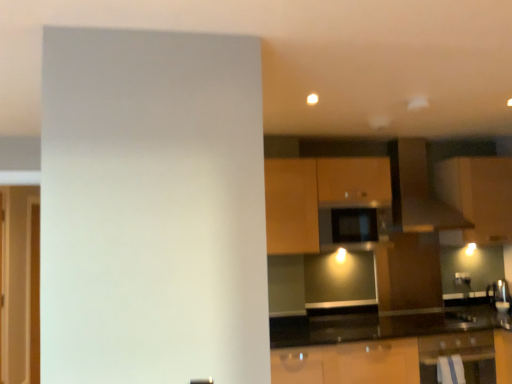
Question: Is matte brown cabinet at upper right, the 3th cabinetry from the left, positioned beyond the bounds of matte brown cabinet at center, marked as the second cabinetry in a left-to-right arrangement?

Choices:
 (A) no
 (B) yes

Answer: (B)

Question: Is matte brown cabinet at upper right, which is the 1th cabinetry in right-to-left order, shorter than matte brown cabinet at center, marked as the second cabinetry in a left-to-right arrangement?

Choices:
 (A) yes
 (B) no

Answer: (B)

Question: Is matte brown cabinet at upper right, the 3th cabinetry from the left, aimed at matte brown cabinet at center, which is counted as the 2th cabinetry, starting from the right?

Choices:
 (A) no
 (B) yes

Answer: (A)

Question: From a real-world perspective, is matte brown cabinet at upper right, the 3th cabinetry from the left, located higher than matte brown cabinet at center, which is counted as the 2th cabinetry, starting from the right?

Choices:
 (A) no
 (B) yes

Answer: (B)

Question: Is matte brown cabinet at upper right, which is the 1th cabinetry in right-to-left order, at the right side of matte brown cabinet at center, marked as the second cabinetry in a left-to-right arrangement?

Choices:
 (A) yes
 (B) no

Answer: (A)

Question: From a real-world perspective, is matte brown cabinet at center, which is counted as the 2th cabinetry, starting from the right, positioned above or below wooden cabinet at center, which appears as the third cabinetry when viewed from the right?

Choices:
 (A) below
 (B) above

Answer: (A)

Question: In the image, is matte brown cabinet at center, marked as the second cabinetry in a left-to-right arrangement, on the left side or the right side of wooden cabinet at center, the 1th cabinetry from the left?

Choices:
 (A) left
 (B) right

Answer: (B)

Question: Is matte brown cabinet at center, marked as the second cabinetry in a left-to-right arrangement, bigger or smaller than wooden cabinet at center, which appears as the third cabinetry when viewed from the right?

Choices:
 (A) big
 (B) small

Answer: (B)

Question: In the image, is matte brown cabinet at center, marked as the second cabinetry in a left-to-right arrangement, positioned in front of or behind wooden cabinet at center, which appears as the third cabinetry when viewed from the right?

Choices:
 (A) behind
 (B) front

Answer: (A)

Question: Based on their positions, is matte brown cabinet at center, marked as the second cabinetry in a left-to-right arrangement, located to the left or right of metallic silver oven at lower right?

Choices:
 (A) left
 (B) right

Answer: (A)

Question: In terms of width, does matte brown cabinet at center, which is counted as the 2th cabinetry, starting from the right, look wider or thinner when compared to metallic silver oven at lower right?

Choices:
 (A) thin
 (B) wide

Answer: (A)

Question: Does point (376, 246) appear closer or farther from the camera than point (437, 375)?

Choices:
 (A) closer
 (B) farther

Answer: (B)

Question: Is matte brown cabinet at center, marked as the second cabinetry in a left-to-right arrangement, in front of or behind metallic silver oven at lower right in the image?

Choices:
 (A) front
 (B) behind

Answer: (B)

Question: Would you say matte brown cabinet at upper right, which is the 1th cabinetry in right-to-left order, is inside or outside metallic silver oven at lower right?

Choices:
 (A) outside
 (B) inside

Answer: (A)

Question: Based on their sizes in the image, would you say matte brown cabinet at upper right, the 3th cabinetry from the left, is bigger or smaller than metallic silver oven at lower right?

Choices:
 (A) small
 (B) big

Answer: (B)